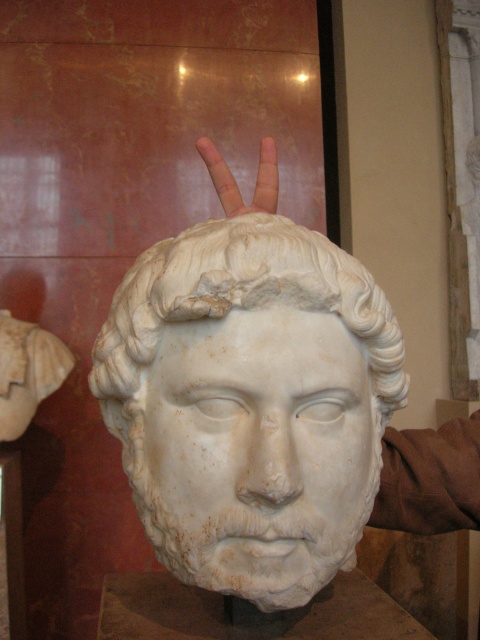
You are an art conservator examining the marble bust. You notice two parts of the sculpture at the center. Which part is located above the other? The white marble head at center or the skinny flesh at center?

The white marble head at center is positioned under skinny flesh at center, so the skinny flesh at center is above the white marble head at center.

You are an art conservator standing 5 feet away from the white marble head at center. Can you reach it without moving closer? The average human arm length is 28 inches.

The white marble head at center is 34.13 inches away from the camera. Since you are standing 5 feet away, which is 60 inches, you are further away than the distance to the camera. Your arm length is 28 inches, so you cannot reach it without moving closer.